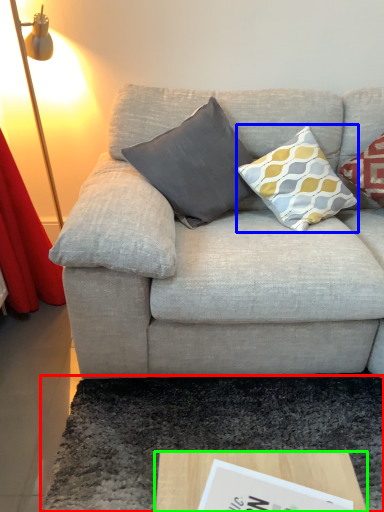
Question: Which is nearer to the mat (highlighted by a red box)? pillow (highlighted by a blue box) or coffee table (highlighted by a green box).

Choices:
 (A) pillow
 (B) coffee table

Answer: (B)